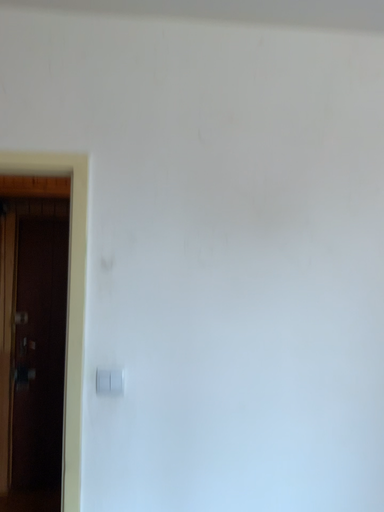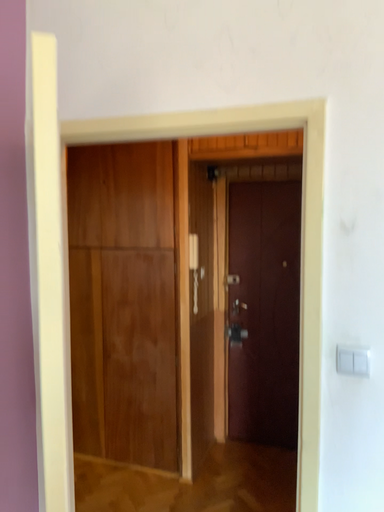
Question: How did the camera likely rotate when shooting the video?

Choices:
 (A) rotated right
 (B) rotated left

Answer: (B)